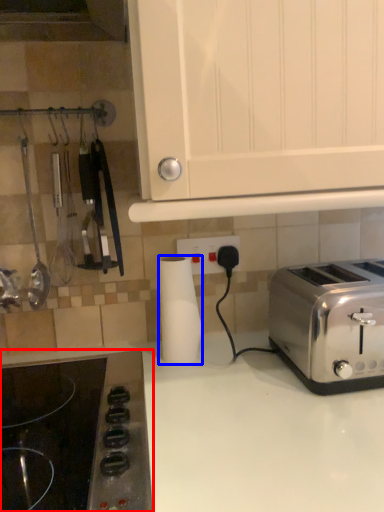
Question: Which of the following is the closest to the observer, gas stove (highlighted by a red box) or paper towel (highlighted by a blue box)?

Choices:
 (A) gas stove
 (B) paper towel

Answer: (A)